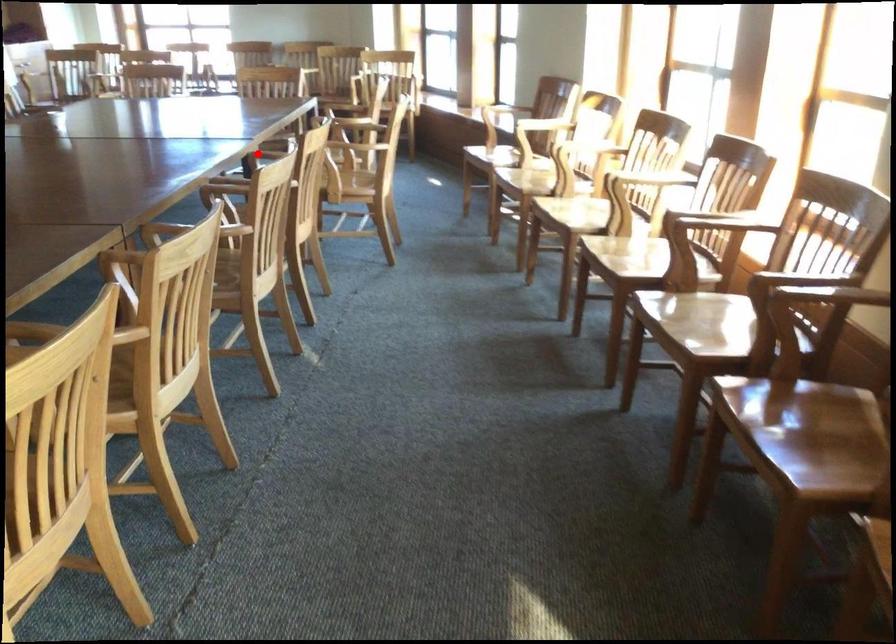
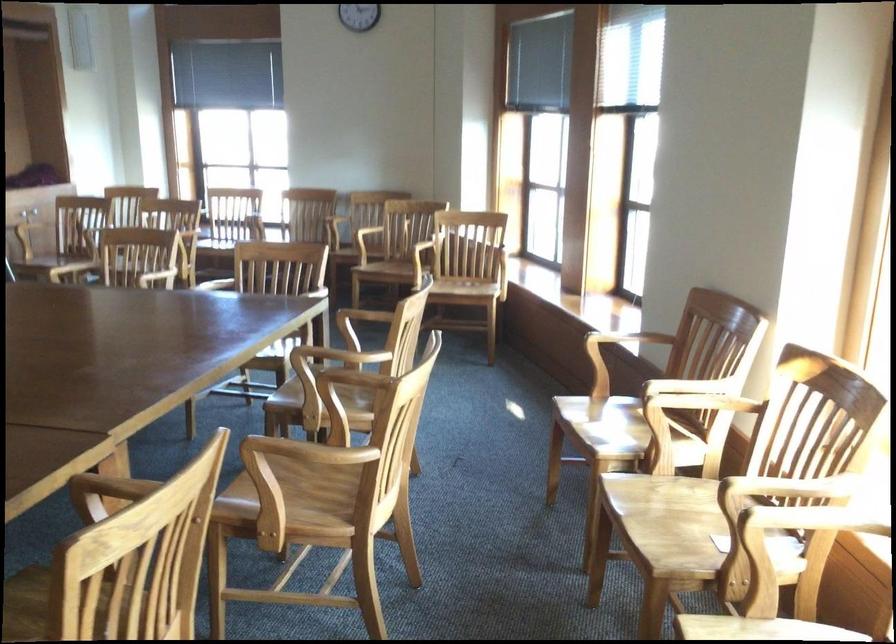
Question: I am providing you with two images of the same scene from different viewpoints. A red point is shown in image1. For the corresponding object point in image2, is it positioned nearer or farther from the camera?

Choices:
 (A) Nearer
 (B) Farther

Answer: (A)